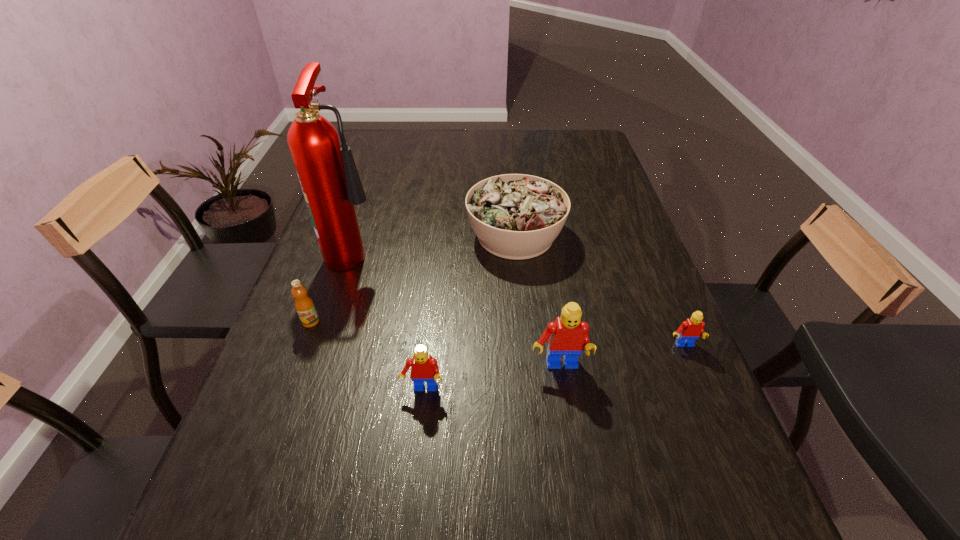
Where is `the third object from left to right`? the third object from left to right is located at coordinates (424, 368).

The image size is (960, 540). In order to click on the leftmost Lego in this screenshot , I will do tap(424, 368).

You are a GUI agent. You are given a task and a screenshot of the screen. Output one action in this format:
    pyautogui.click(x=<x>, y=<y>)
    Task: Click on the fifth shortest object
    This screenshot has height=540, width=960.
    Given the screenshot: What is the action you would take?
    pyautogui.click(x=567, y=335)

The height and width of the screenshot is (540, 960). What are the coordinates of `the second Lego from left to right` in the screenshot? It's located at click(x=567, y=335).

This screenshot has width=960, height=540. What are the coordinates of `the rightmost object` in the screenshot? It's located at (691, 329).

You are a GUI agent. You are given a task and a screenshot of the screen. Output one action in this format:
    pyautogui.click(x=<x>, y=<y>)
    Task: Click on the shortest object
    This screenshot has width=960, height=540.
    Given the screenshot: What is the action you would take?
    pyautogui.click(x=691, y=329)

This screenshot has height=540, width=960. I want to click on fire extinguisher, so click(x=328, y=175).

This screenshot has width=960, height=540. What are the coordinates of `salad` in the screenshot? It's located at (515, 216).

Image resolution: width=960 pixels, height=540 pixels. In order to click on the fourth nearest object in this screenshot , I will do `click(304, 305)`.

This screenshot has height=540, width=960. I want to click on vacant space located 0.070m on the front-facing side of the leftmost Lego, so click(418, 431).